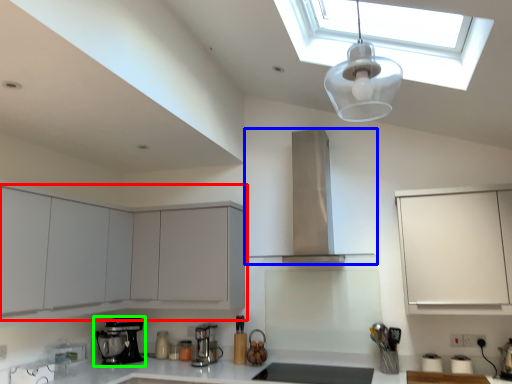
Question: Which object is the farthest from cabinetry (highlighted by a red box)? Choose among these: home appliance (highlighted by a blue box) or kitchen appliance (highlighted by a green box).

Choices:
 (A) home appliance
 (B) kitchen appliance

Answer: (A)